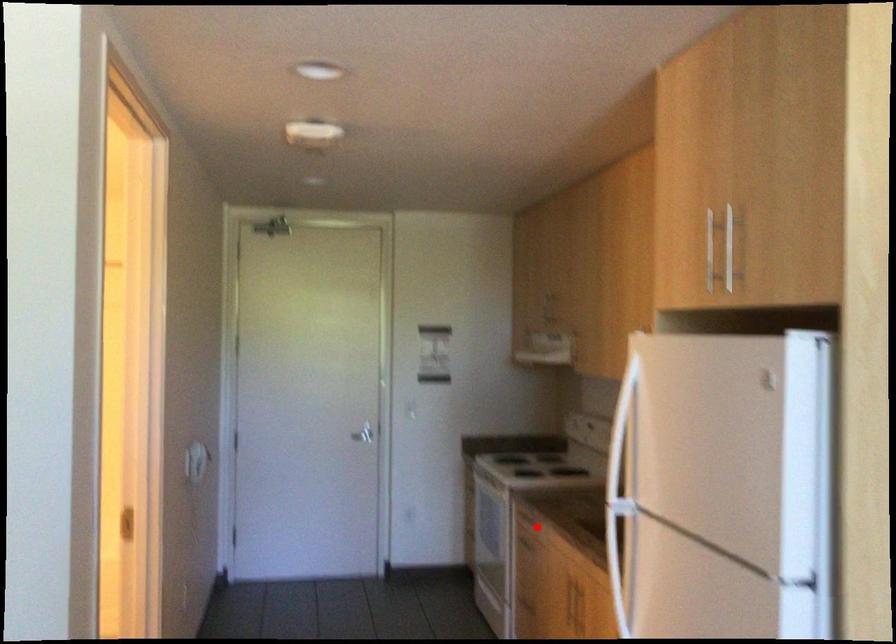
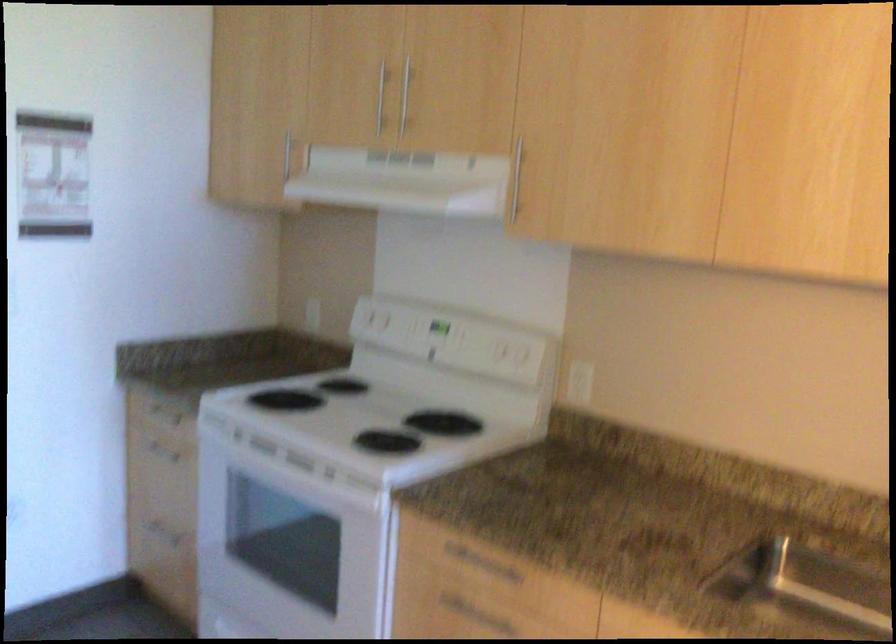
The point at the highlighted location is marked in the first image. Where is the corresponding point in the second image?

(466, 609)